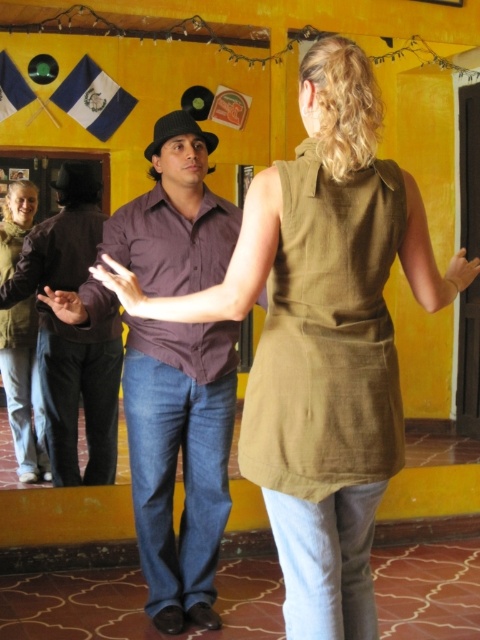
Between point (167, 456) and point (96, 385), which one is positioned behind?

The point (96, 385) is behind.

Can you confirm if purple cotton shirt at center is positioned below matte brown shirt at center?

Correct, purple cotton shirt at center is located below matte brown shirt at center.

At what (x,y) coordinates should I click in order to perform the action: click on purple cotton shirt at center. Please return your answer as a coordinate pair (x, y). The image size is (480, 640). Looking at the image, I should click on [177, 456].

This screenshot has height=640, width=480. In order to click on purple cotton shirt at center in this screenshot , I will do `click(177, 456)`.

Does matte brown shirt at center have a lesser width compared to matte green jacket at left?

Incorrect, matte brown shirt at center's width is not less than matte green jacket at left's.

Image resolution: width=480 pixels, height=640 pixels. Describe the element at coordinates (80, 394) in the screenshot. I see `matte brown shirt at center` at that location.

Identify the location of matte brown shirt at center. (80, 394).

Can you confirm if purple cotton shirt at center is taller than matte green jacket at left?

Yes.

Between purple cotton shirt at center and matte green jacket at left, which one appears on the right side from the viewer's perspective?

Positioned to the right is purple cotton shirt at center.

Is point (216, 392) behind point (16, 188)?

That is False.

The image size is (480, 640). In order to click on purple cotton shirt at center in this screenshot , I will do `click(177, 456)`.